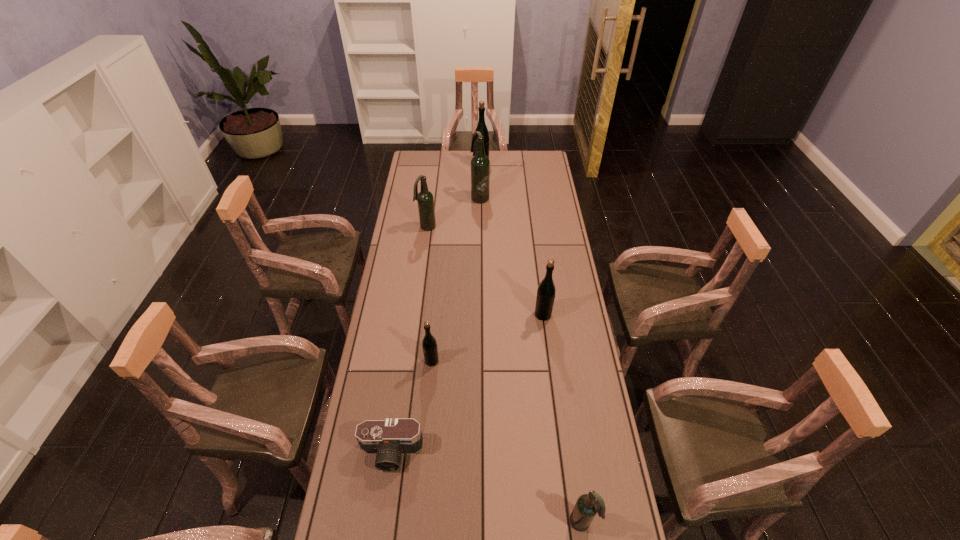
Select which beer bottle is the closest to the second nearest dark beer bottle. Please provide its 2D coordinates. Your answer should be formatted as a tuple, i.e. [(x, y)], where the tuple contains the x and y coordinates of a point satisfying the conditions above.

[(480, 165)]

I want to click on green beer bottle that is the second closest to the camera, so click(546, 290).

The width and height of the screenshot is (960, 540). What are the coordinates of `the closest green beer bottle to the fourth farthest beer bottle` in the screenshot? It's located at (429, 344).

Locate which dark beer bottle ranks third in proximity to the fifth beer bottle from right to left. Please provide its 2D coordinates. Your answer should be formatted as a tuple, i.e. [(x, y)], where the tuple contains the x and y coordinates of a point satisfying the conditions above.

[(480, 165)]

Point out which dark beer bottle is positioned as the third nearest to the fifth farthest object. Please provide its 2D coordinates. Your answer should be formatted as a tuple, i.e. [(x, y)], where the tuple contains the x and y coordinates of a point satisfying the conditions above.

[(480, 165)]

Image resolution: width=960 pixels, height=540 pixels. I want to click on vacant space that satisfies the following two spatial constraints: 1. on the back side of the second dark beer bottle from left to right; 2. on the right side of the farthest object, so click(x=480, y=165).